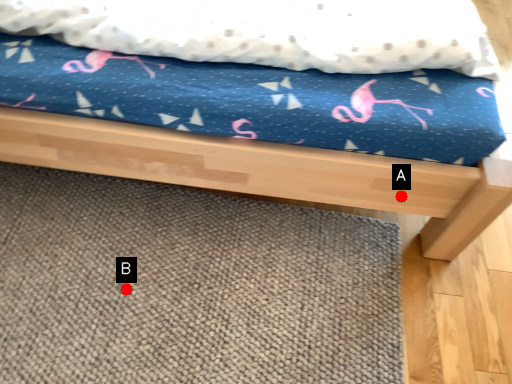
Question: Two points are circled on the image, labeled by A and B beside each circle. Which point appears farthest from the camera in this image?

Choices:
 (A) A is further
 (B) B is further

Answer: (B)